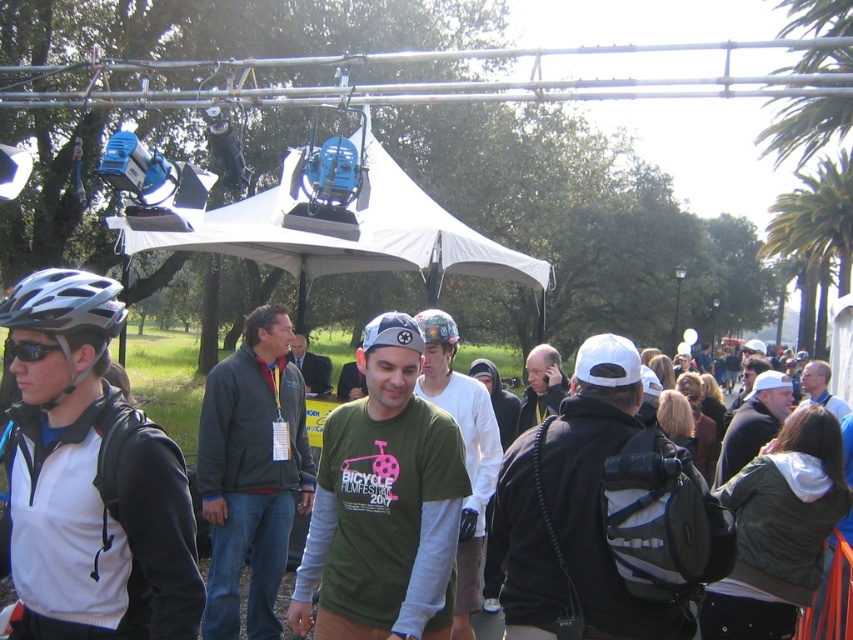
You are at the event and want to take a photo of the gray fleece jacket at center without the green cotton shirt at center blocking it. What should you do?

Move behind the gray fleece jacket at center so that it is between you and the green cotton shirt at center. Since the green cotton shirt at center is in front of the gray fleece jacket at center, moving behind the jacket will allow you to capture it without obstruction.